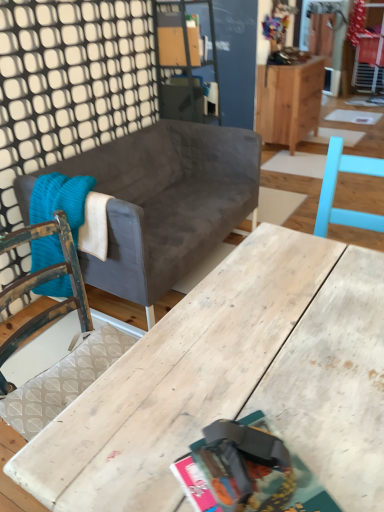
Locate an element on the screen. Image resolution: width=384 pixels, height=512 pixels. vacant space situated above matte paper magazine at center (from a real-world perspective) is located at coordinates (251, 478).